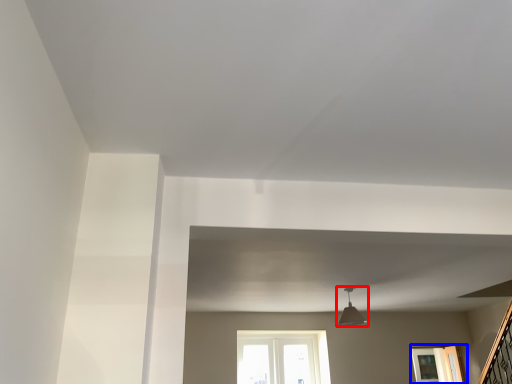
Question: Which point is further to the camera, light fixture (highlighted by a red box) or window (highlighted by a blue box)?

Choices:
 (A) light fixture
 (B) window

Answer: (B)